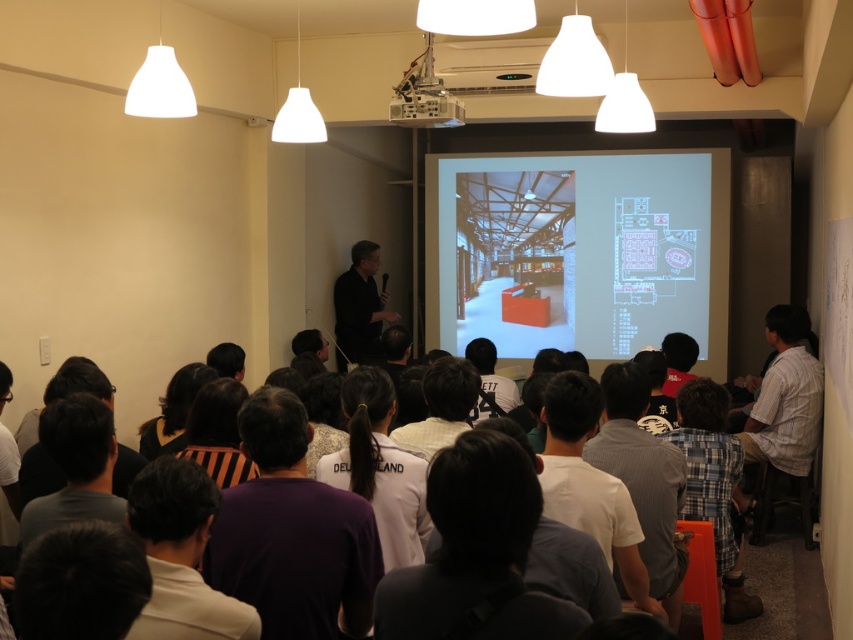
You are an attendee at the presentation. You notice two people in the audience. One is wearing a gray cotton shirt at center, and the other has dark gray hair at lower left. Which person is positioned more to the right side of the audience?

The gray cotton shirt at center is positioned more to the right side of the audience than the dark gray hair at lower left.